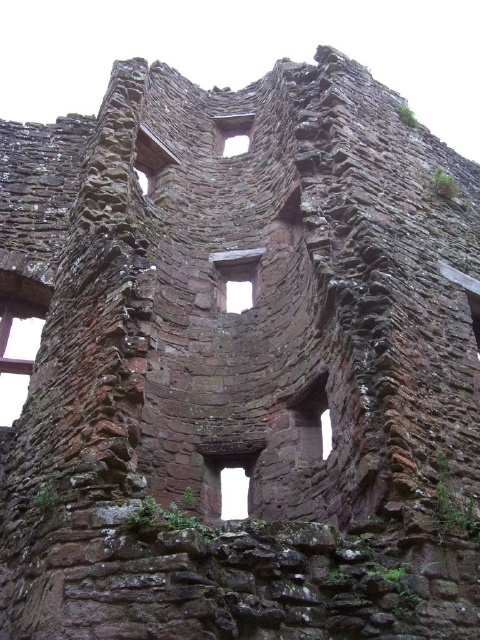
Can you confirm if brown stone window at left is wider than transparent stone window at center?

No, brown stone window at left is not wider than transparent stone window at center.

Who is more forward, (17, 323) or (241, 301)?

Point (17, 323) is in front.

Who is more forward, (28, 346) or (231, 301)?

Point (28, 346) is in front.

The width and height of the screenshot is (480, 640). What are the coordinates of `brown stone window at left` in the screenshot? It's located at (20, 333).